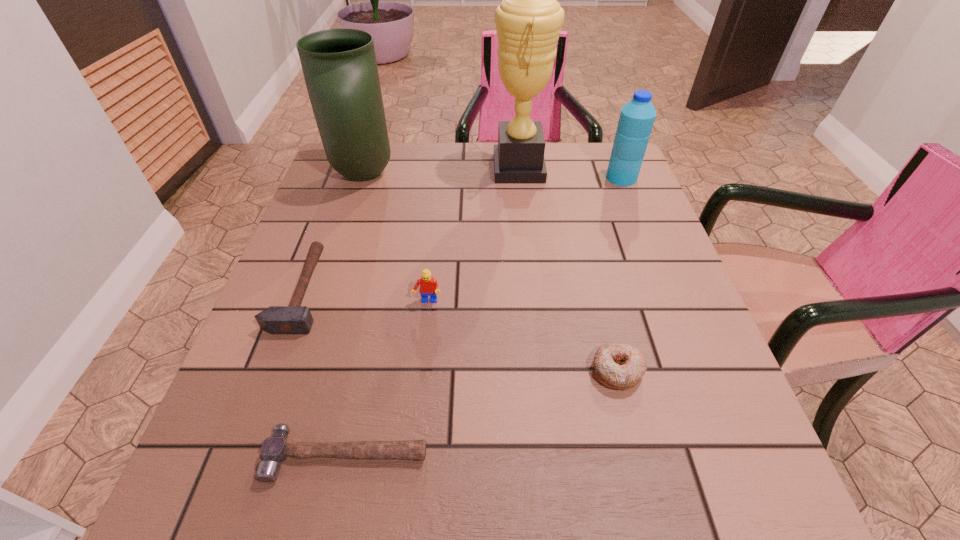
Find the location of a particular element. This screenshot has width=960, height=540. the fifth object from left to right is located at coordinates (528, 21).

Locate an element on the screen. The height and width of the screenshot is (540, 960). trophy cup is located at coordinates (528, 21).

The width and height of the screenshot is (960, 540). In order to click on the sixth shortest object in this screenshot , I will do `click(339, 66)`.

Where is `the fifth shortest object`? The height and width of the screenshot is (540, 960). the fifth shortest object is located at coordinates (637, 116).

Locate an element on the screen. water bottle is located at coordinates (637, 116).

This screenshot has height=540, width=960. I want to click on the fourth shortest object, so click(428, 285).

Where is `the taller hammer`? Image resolution: width=960 pixels, height=540 pixels. the taller hammer is located at coordinates (294, 319).

Find the location of a particular element. The height and width of the screenshot is (540, 960). doughnut is located at coordinates (617, 365).

Identify the location of the second object from right to left. This screenshot has height=540, width=960. (617, 365).

Locate an element on the screen. Image resolution: width=960 pixels, height=540 pixels. the nearest object is located at coordinates (275, 449).